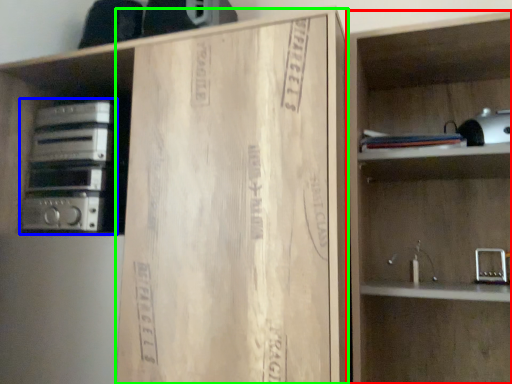
Question: Which is nearer to the shelf (highlighted by a red box)? stereo (highlighted by a blue box) or cardboard (highlighted by a green box).

Choices:
 (A) stereo
 (B) cardboard

Answer: (B)